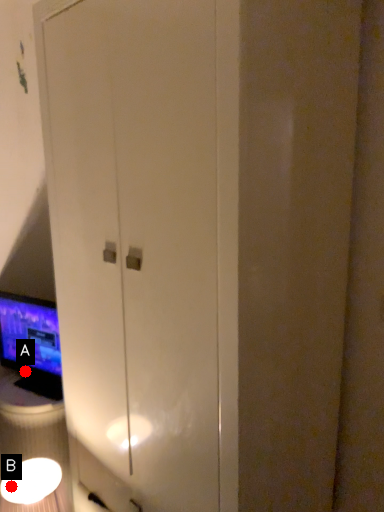
Question: Two points are circled on the image, labeled by A and B beside each circle. Which point is closer to the camera taking this photo?

Choices:
 (A) A is closer
 (B) B is closer

Answer: (B)